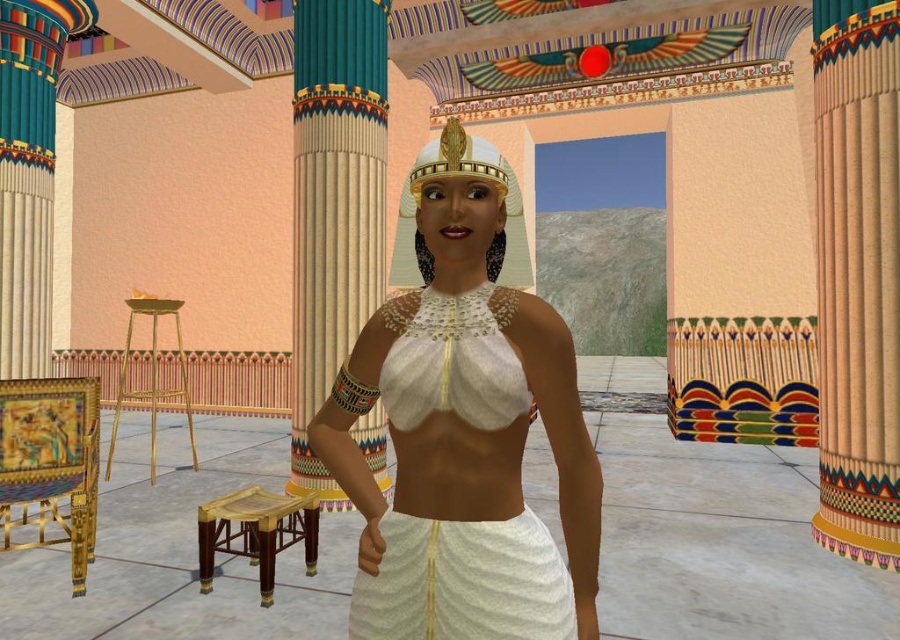
Question: Is wooden stool at lower left further to the viewer compared to gold metallic stool at left?

Choices:
 (A) no
 (B) yes

Answer: (A)

Question: Is white matte fabric at center to the right of gold metallic stool at left from the viewer's perspective?

Choices:
 (A) no
 (B) yes

Answer: (B)

Question: Which point appears closest to the camera in this image?

Choices:
 (A) (491, 330)
 (B) (418, 177)
 (C) (176, 314)

Answer: (A)

Question: Estimate the real-world distances between objects in this image. Which object is farther from the white matte fabric at center?

Choices:
 (A) wooden stool at lower left
 (B) white glossy headdress at center
 (C) beige textured column at right

Answer: (C)

Question: Which is nearer to the wooden stool at lower left?

Choices:
 (A) white matte fabric at center
 (B) smooth beige column at center
 (C) gold metallic stool at left
 (D) beige textured column at right

Answer: (B)

Question: Is beige textured column at right wider than wooden stool at lower left?

Choices:
 (A) no
 (B) yes

Answer: (A)